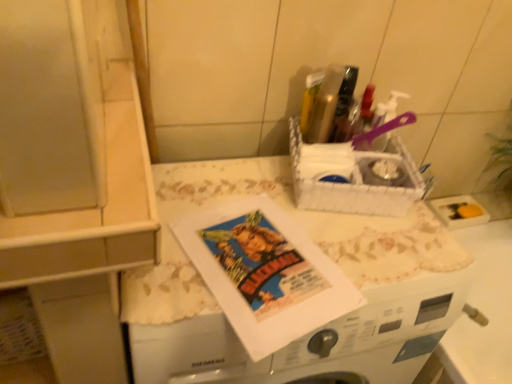
Where is `vacant space situated above white plastic washing machine at center (from a real-world perspective)`? vacant space situated above white plastic washing machine at center (from a real-world perspective) is located at coordinates (285, 244).